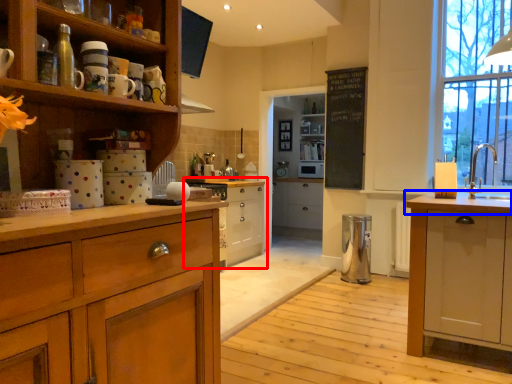
Question: Which object is closer to the camera taking this photo, cabinetry (highlighted by a red box) or countertop (highlighted by a blue box)?

Choices:
 (A) cabinetry
 (B) countertop

Answer: (B)